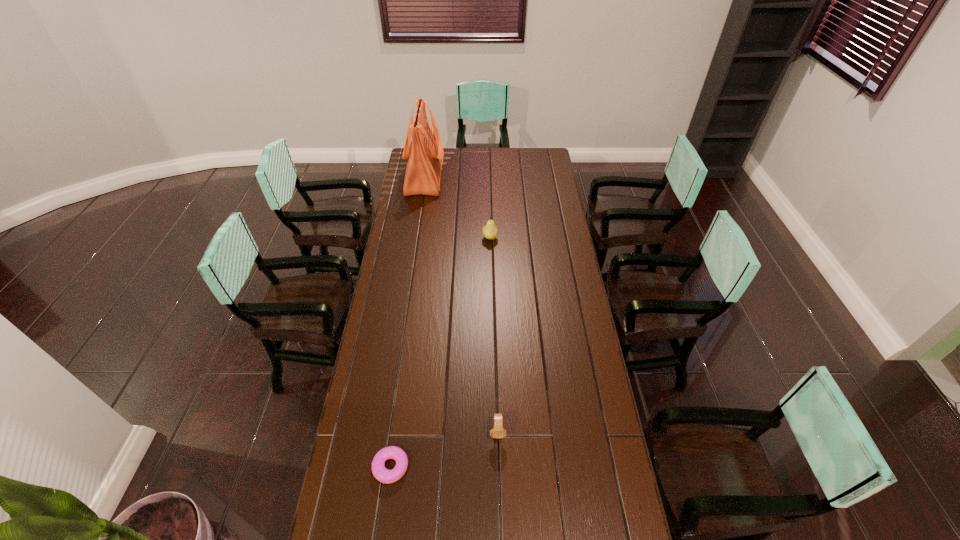
Locate an element on the screen. blank space located on the face of the second shortest object is located at coordinates (500, 524).

This screenshot has width=960, height=540. Identify the location of vacant space located on the back of the nearest object. (403, 373).

What are the coordinates of `object at the far edge` in the screenshot? It's located at (425, 153).

This screenshot has width=960, height=540. Find the location of `shopping bag at the left edge`. shopping bag at the left edge is located at coordinates (425, 153).

At what (x,y) coordinates should I click in order to perform the action: click on doughnut situated at the left edge. Please return your answer as a coordinate pair (x, y). The width and height of the screenshot is (960, 540). Looking at the image, I should click on click(379, 471).

I want to click on object positioned at the far left corner, so click(x=425, y=153).

Locate an element on the screen. blank space at the far edge of the desktop is located at coordinates (476, 165).

Find the location of a particular element. vacant space at the left edge of the desktop is located at coordinates (392, 372).

You are a GUI agent. You are given a task and a screenshot of the screen. Output one action in this format:
    pyautogui.click(x=<x>, y=<y>)
    Task: Click on the free space at the right edge
    The height and width of the screenshot is (540, 960).
    Given the screenshot: What is the action you would take?
    pyautogui.click(x=590, y=418)

You are a GUI agent. You are given a task and a screenshot of the screen. Output one action in this format:
    pyautogui.click(x=<x>, y=<y>)
    Task: Click on the unoccupied area between the pear and the shortest object
    
    Given the screenshot: What is the action you would take?
    pyautogui.click(x=441, y=352)